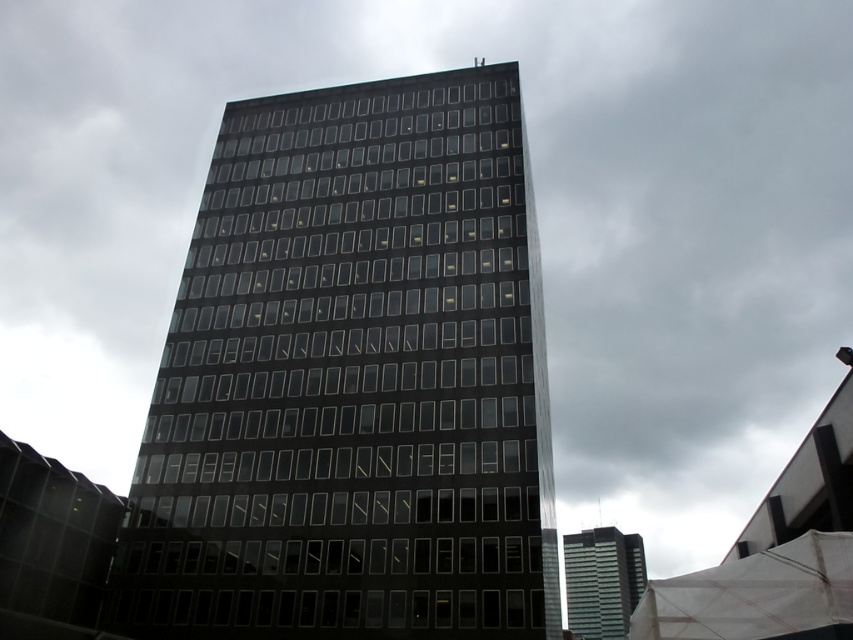
Who is more forward, (134, 548) or (590, 627)?

Positioned in front is point (134, 548).

Does black glass building at center lie behind glassy reflective skyscraper at center?

No, black glass building at center is in front of glassy reflective skyscraper at center.

Locate an element on the screen. This screenshot has height=640, width=853. black glass building at center is located at coordinates (352, 380).

Locate an element on the screen. The width and height of the screenshot is (853, 640). black glass building at center is located at coordinates (352, 380).